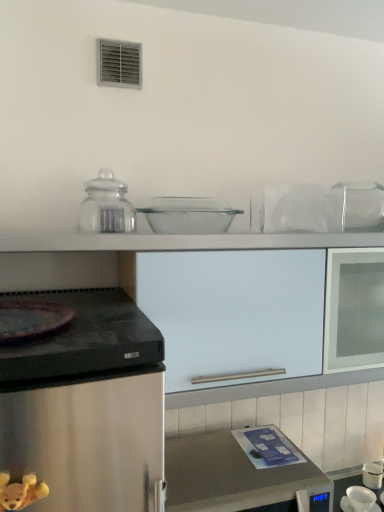
Question: Is there a large distance between white matte cabinet at center and transparent glass jar at upper center?

Choices:
 (A) yes
 (B) no

Answer: (B)

Question: Can you confirm if white matte cabinet at center is bigger than transparent glass jar at upper center?

Choices:
 (A) yes
 (B) no

Answer: (A)

Question: From the image's perspective, would you say white matte cabinet at center is positioned over transparent glass jar at upper center?

Choices:
 (A) no
 (B) yes

Answer: (A)

Question: From a real-world perspective, is white matte cabinet at center under transparent glass jar at upper center?

Choices:
 (A) no
 (B) yes

Answer: (B)

Question: Is white matte cabinet at center smaller than transparent glass jar at upper center?

Choices:
 (A) no
 (B) yes

Answer: (A)

Question: Is white matte cabinet at center facing away from transparent glass jar at upper center?

Choices:
 (A) yes
 (B) no

Answer: (B)

Question: Considering the relative sizes of metallic stainless steel microwave at lower center and white glossy cup at lower right, which is the first appliance from right to left, in the image provided, is metallic stainless steel microwave at lower center thinner than white glossy cup at lower right, which is the first appliance from right to left,?

Choices:
 (A) no
 (B) yes

Answer: (A)

Question: Is metallic stainless steel microwave at lower center positioned far away from white glossy cup at lower right, which ranks as the 2th appliance in front-to-back order?

Choices:
 (A) no
 (B) yes

Answer: (A)

Question: Does metallic stainless steel microwave at lower center appear on the left side of white glossy cup at lower right, which is the second appliance from left to right?

Choices:
 (A) yes
 (B) no

Answer: (A)

Question: From a real-world perspective, is metallic stainless steel microwave at lower center physically below white glossy cup at lower right, which is the first appliance from right to left?

Choices:
 (A) yes
 (B) no

Answer: (B)

Question: From a real-world perspective, is metallic stainless steel microwave at lower center on top of white glossy cup at lower right, which ranks as the 2th appliance in front-to-back order?

Choices:
 (A) no
 (B) yes

Answer: (B)

Question: Can you confirm if metallic stainless steel microwave at lower center is smaller than white glossy cup at lower right, positioned as the first appliance in back-to-front order?

Choices:
 (A) yes
 (B) no

Answer: (B)

Question: Is metallic stainless steel microwave at lower center in contact with clear glass bowl at center, acting as the 1th appliance starting from the left?

Choices:
 (A) no
 (B) yes

Answer: (A)